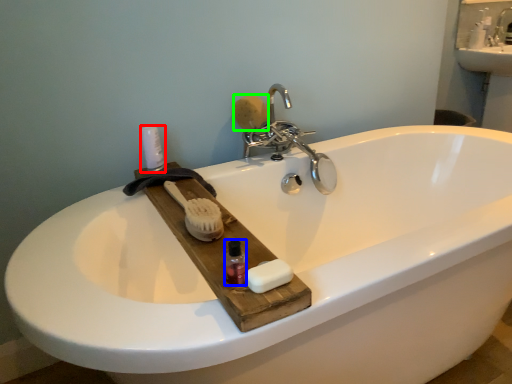
Question: Estimate the real-world distances between objects in this image. Which object is closer to toiletry (highlighted by a red box), mouthwash (highlighted by a blue box) or soap (highlighted by a green box)?

Choices:
 (A) mouthwash
 (B) soap

Answer: (B)